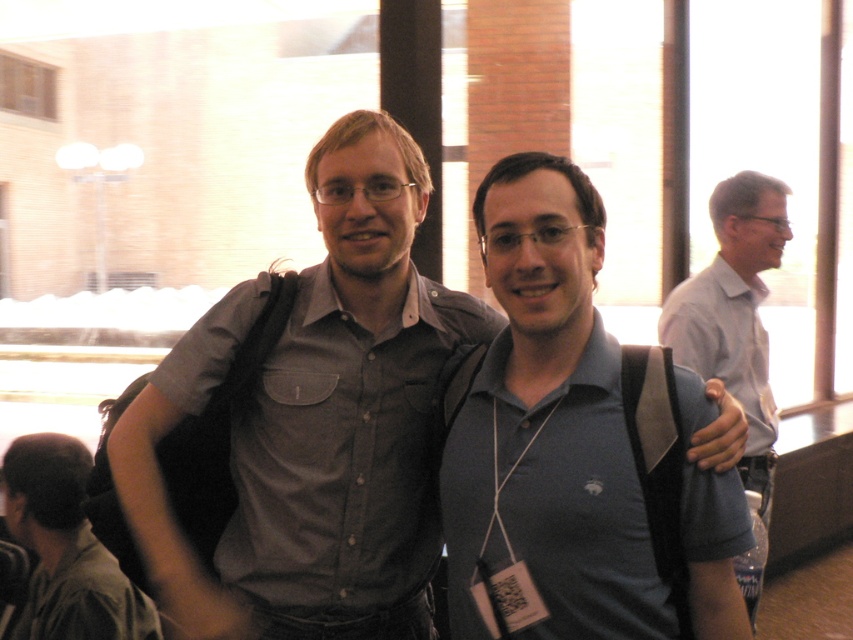
Question: From the image, what is the correct spatial relationship of matte gray shirt at center in relation to dark gray shirt at lower left?

Choices:
 (A) below
 (B) above

Answer: (B)

Question: Which object appears closest to the camera in this image?

Choices:
 (A) blue fabric shirt at center
 (B) dark gray shirt at lower left

Answer: (A)

Question: Does blue fabric shirt at center have a larger size compared to dark gray shirt at lower left?

Choices:
 (A) no
 (B) yes

Answer: (A)

Question: Which of the following is the closest to the observer?

Choices:
 (A) gray shirt at right
 (B) matte gray shirt at center

Answer: (B)

Question: Is matte gray shirt at center above dark gray shirt at lower left?

Choices:
 (A) yes
 (B) no

Answer: (A)

Question: Considering the real-world distances, which object is farthest from the blue fabric shirt at center?

Choices:
 (A) gray shirt at right
 (B) dark gray shirt at lower left

Answer: (A)